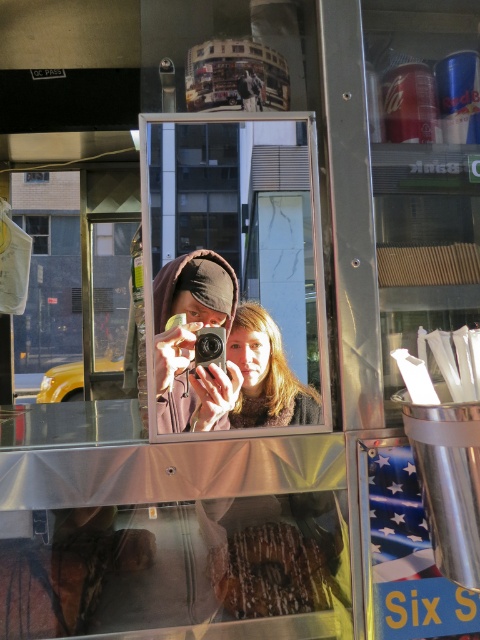
Question: Which object is closer to the camera taking this photo?

Choices:
 (A) black plastic camera at center
 (B) glazed chocolate donut at center

Answer: (A)

Question: Is matte black camera at center wider than matte brown hair at center?

Choices:
 (A) no
 (B) yes

Answer: (A)

Question: Can you confirm if matte black camera at center is thinner than black plastic camera at center?

Choices:
 (A) yes
 (B) no

Answer: (B)

Question: Which point is farther to the camera?

Choices:
 (A) [x=217, y=420]
 (B) [x=313, y=609]
 (C) [x=250, y=317]

Answer: (B)

Question: Which point appears closest to the camera in this image?

Choices:
 (A) (158, 339)
 (B) (232, 598)

Answer: (A)

Question: Is glazed chocolate donut at center to the left of black plastic camera at center from the viewer's perspective?

Choices:
 (A) no
 (B) yes

Answer: (A)